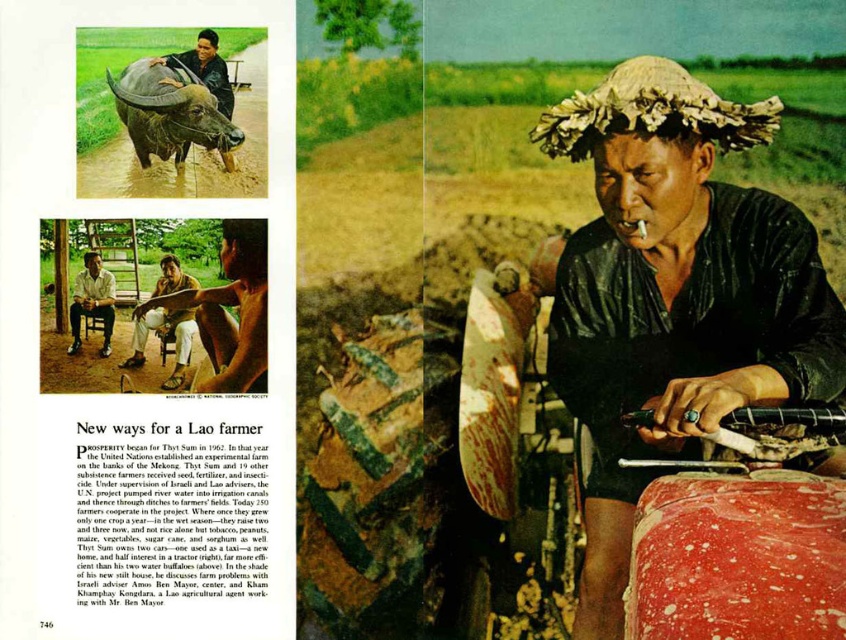
In the bottom section of the image, there is a wet black shirt at center. Is the wet black shirt at center located to the left or right of the point with coordinates (x=673, y=296)?

The point with coordinates (x=673, y=296) indicates the location of the wet black shirt at center, so it is exactly at that point.

Based on the photo, you are an anthropologist studying traditional clothing and furniture in Laos. You notice the brown leather shirt at center and the light brown wooden chair at lower left in the image. Which object occupies more horizontal space in the scene?

The brown leather shirt at center might be wider than light brown wooden chair at lower left, so it possibly occupies more horizontal space.